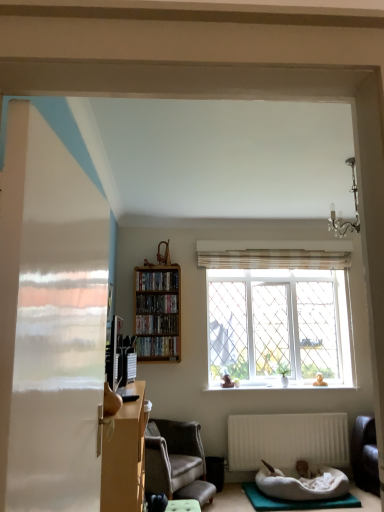
Question: Does white matte radiator at lower center lie behind wooden bookshelf at center?

Choices:
 (A) no
 (B) yes

Answer: (A)

Question: Can you confirm if white matte radiator at lower center is smaller than wooden bookshelf at center?

Choices:
 (A) no
 (B) yes

Answer: (B)

Question: Is white matte radiator at lower center surrounding wooden bookshelf at center?

Choices:
 (A) no
 (B) yes

Answer: (A)

Question: Is white matte radiator at lower center in contact with wooden bookshelf at center?

Choices:
 (A) yes
 (B) no

Answer: (B)

Question: Are white matte radiator at lower center and wooden bookshelf at center located far from each other?

Choices:
 (A) no
 (B) yes

Answer: (B)

Question: Is white matte radiator at lower center wider than wooden bookshelf at center?

Choices:
 (A) no
 (B) yes

Answer: (A)

Question: Considering the relative sizes of wooden shelf at upper center, acting as the fourth book starting from the bottom, and matte black bookshelf at center, which is counted as the fourth book, starting from the top, in the image provided, is wooden shelf at upper center, acting as the fourth book starting from the bottom, shorter than matte black bookshelf at center, which is counted as the fourth book, starting from the top,?

Choices:
 (A) no
 (B) yes

Answer: (B)

Question: Considering the relative sizes of wooden shelf at upper center, the 1th book in the top-to-bottom sequence, and matte black bookshelf at center, which is counted as the fourth book, starting from the top, in the image provided, is wooden shelf at upper center, the 1th book in the top-to-bottom sequence, smaller than matte black bookshelf at center, which is counted as the fourth book, starting from the top,?

Choices:
 (A) yes
 (B) no

Answer: (A)

Question: Is wooden shelf at upper center, acting as the fourth book starting from the bottom, in front of matte black bookshelf at center, which is counted as the fourth book, starting from the top?

Choices:
 (A) no
 (B) yes

Answer: (A)

Question: Is wooden shelf at upper center, acting as the fourth book starting from the bottom, oriented towards matte black bookshelf at center, which is counted as the fourth book, starting from the top?

Choices:
 (A) yes
 (B) no

Answer: (B)

Question: Is matte black bookshelf at center, which is counted as the fourth book, starting from the top, inside wooden shelf at upper center, the 1th book in the top-to-bottom sequence?

Choices:
 (A) yes
 (B) no

Answer: (B)

Question: From a real-world perspective, is wooden shelf at upper center, the 1th book in the top-to-bottom sequence, located beneath matte black bookshelf at center, which is counted as the fourth book, starting from the top?

Choices:
 (A) yes
 (B) no

Answer: (B)

Question: Does matte brown desk at left have a larger size compared to wooden shelf at upper center, the 1th book in the top-to-bottom sequence?

Choices:
 (A) yes
 (B) no

Answer: (A)